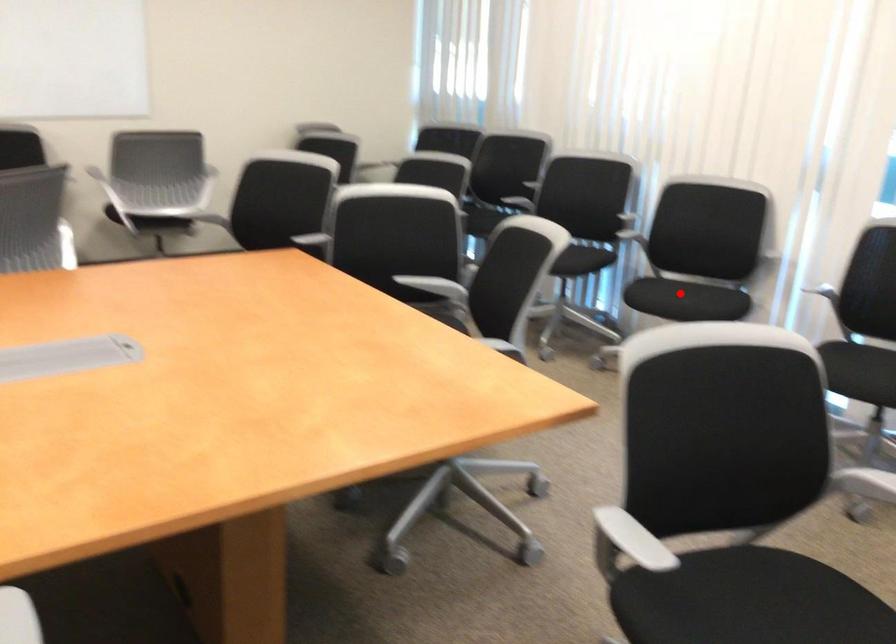
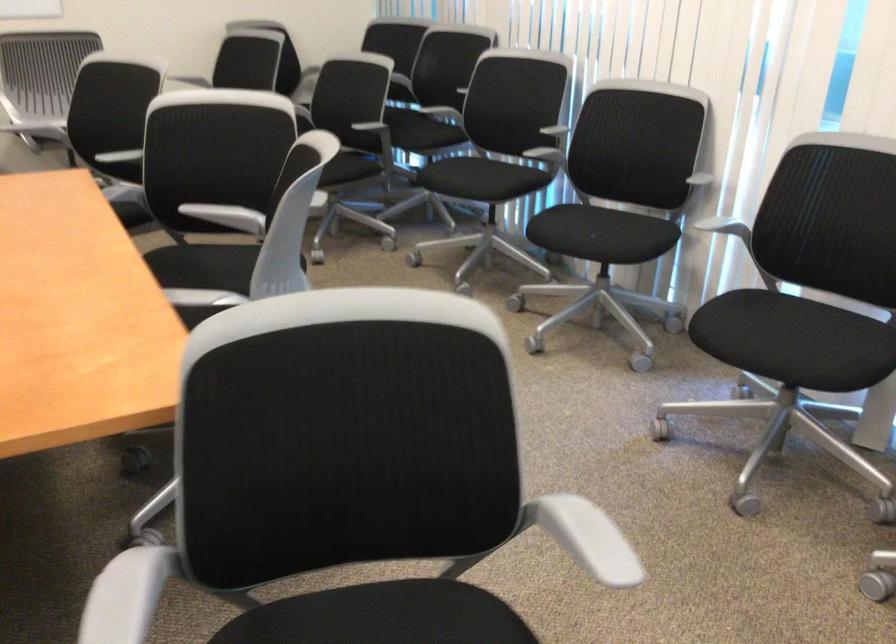
Question: I am providing you with two images of the same scene from different viewpoints. A red point is shown in image1. For the corresponding object point in image2, is it positioned nearer or farther from the camera?

Choices:
 (A) Nearer
 (B) Farther

Answer: (A)